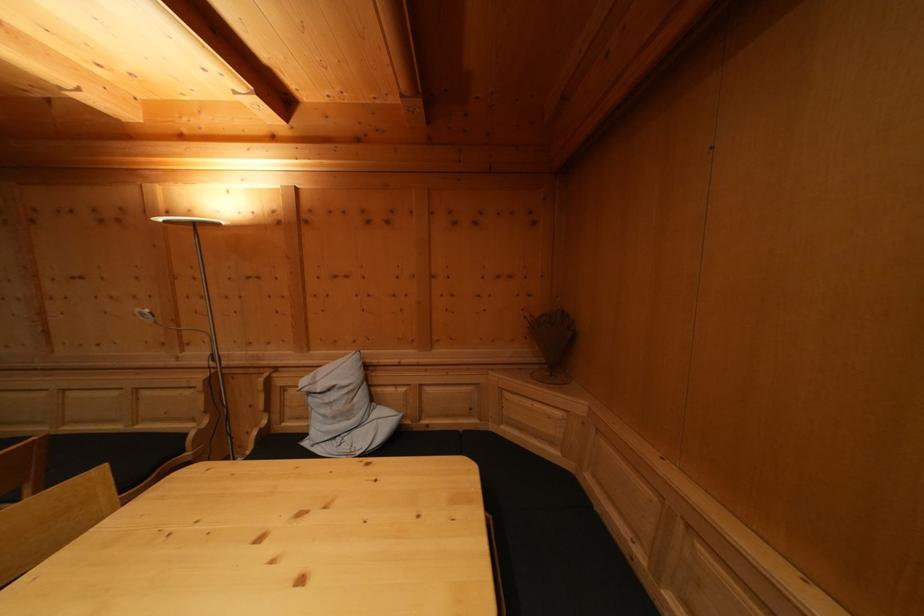
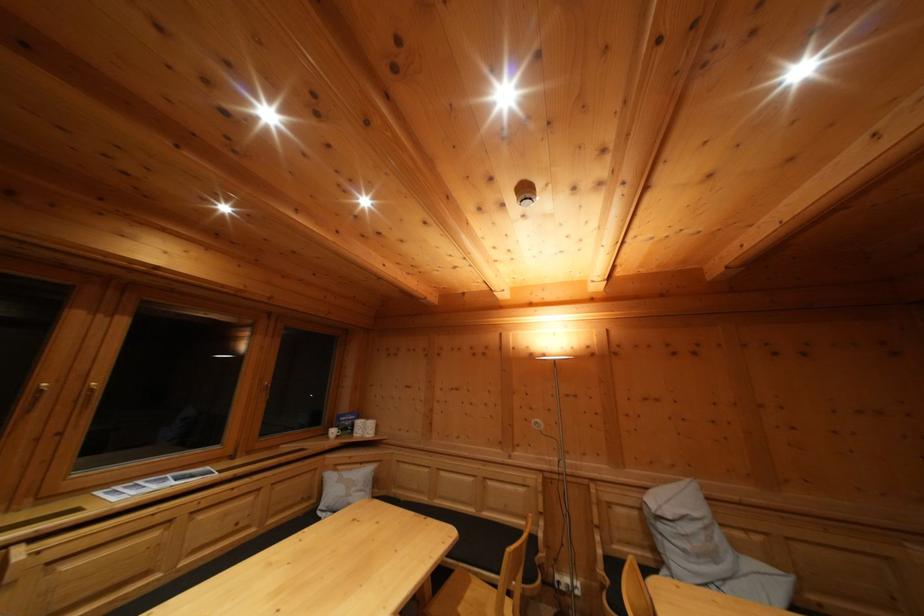
Find the pixel in the second image that matches (200,427) in the first image.

(532, 525)